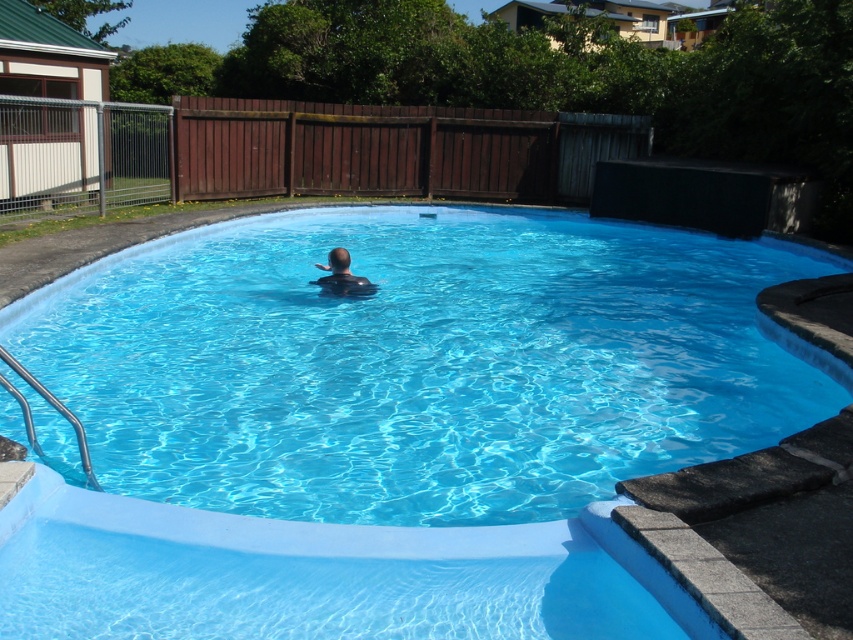
You are a lifeguard standing at the edge of the blue smooth pool at center. You notice the dark blue skin at center in the water. Based on their height compared to the pool, is the person fully submerged or partially visible above the water?

The blue smooth pool at center is taller than dark blue skin at center, which means the pool is deeper than the person. Therefore, the person is partially visible above the water since their skin is shorter than the pool.

You are standing at the edge of the blue smooth pool at center and want to reach the dark blue skin at center. Which direction should you move to get there?

You should move to the left because the blue smooth pool at center is to the right of dark blue skin at center, so moving left will bring you towards the dark blue skin at center.